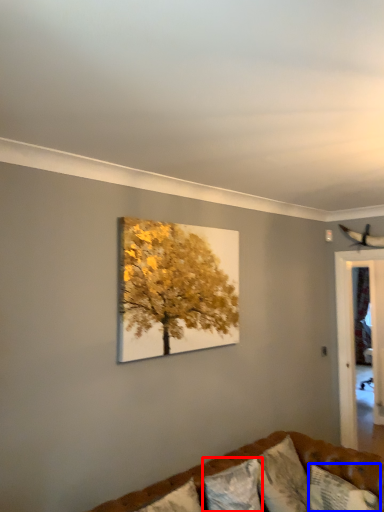
Question: Which of the following is the closest to the observer, pillow (highlighted by a red box) or pillow (highlighted by a blue box)?

Choices:
 (A) pillow
 (B) pillow

Answer: (A)